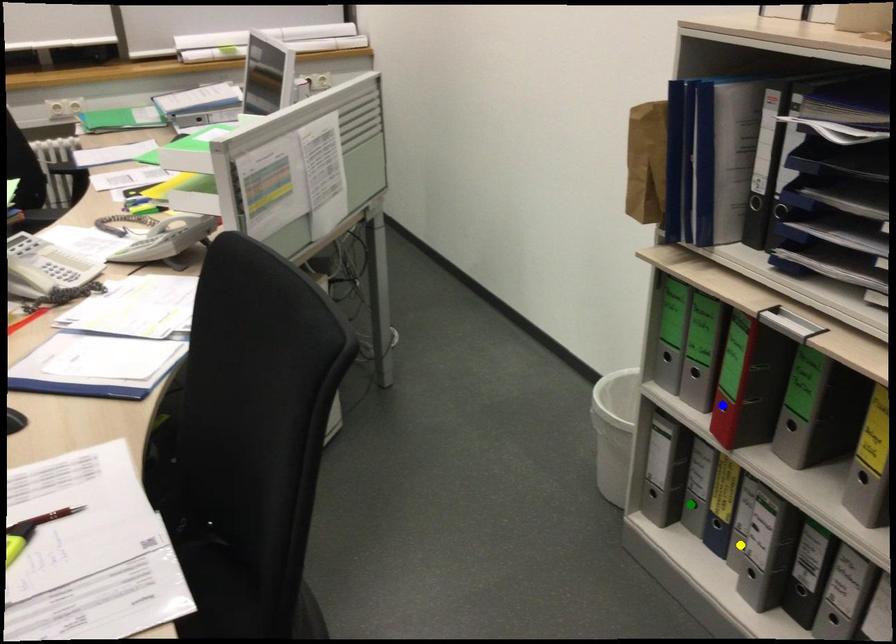
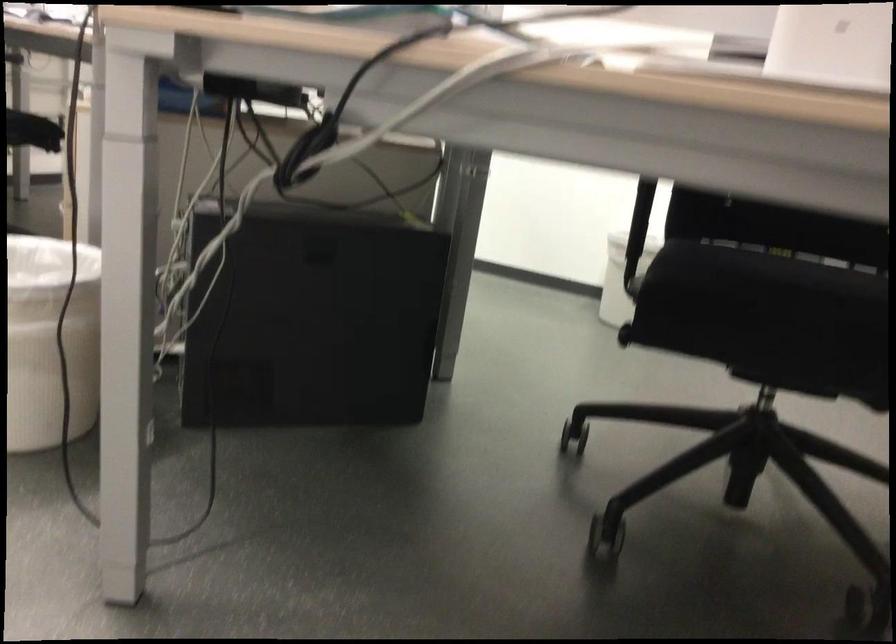
I am providing you with two images of the same scene from different viewpoints. Three points are marked in image1. Which point corresponds to a part or object that is occluded in image2?In image1, three points are marked. Which of them correspond to a part or object that is occluded in image2?Among the three points shown in image1, which one corresponds to a part or object that is no longer visible due to occlusion in image2?

green point, blue point, yellow point